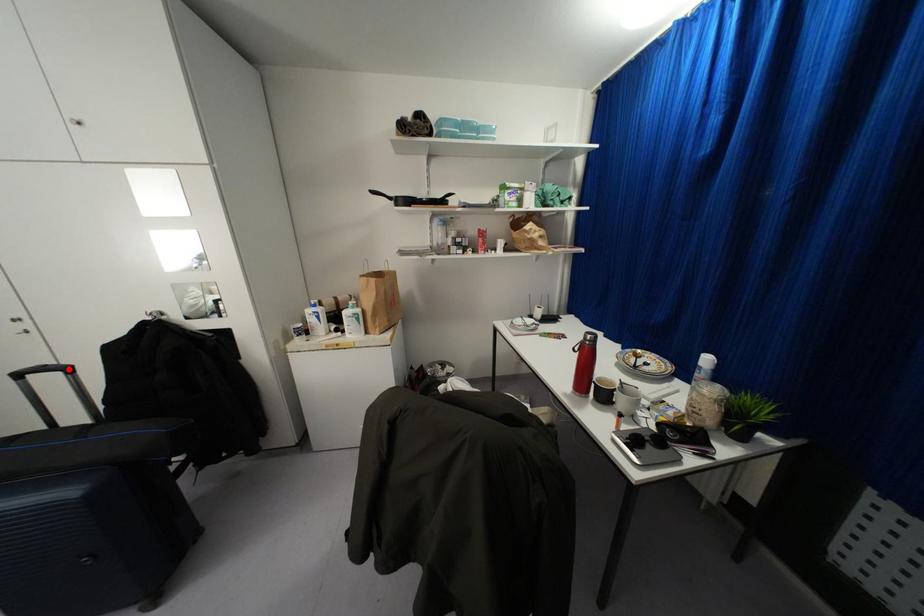
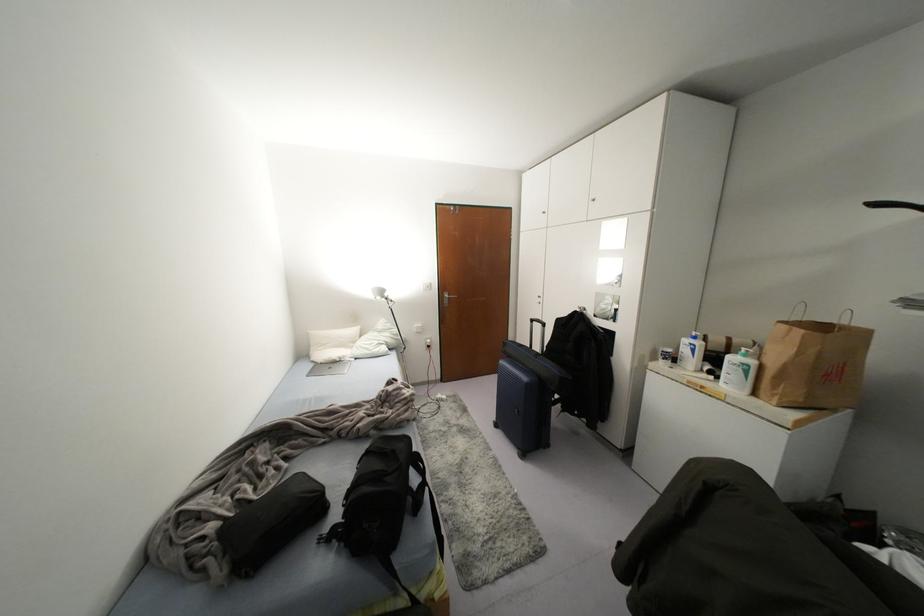
In the second image, find the point that corresponds to the highlighted location in the first image.

(542, 323)